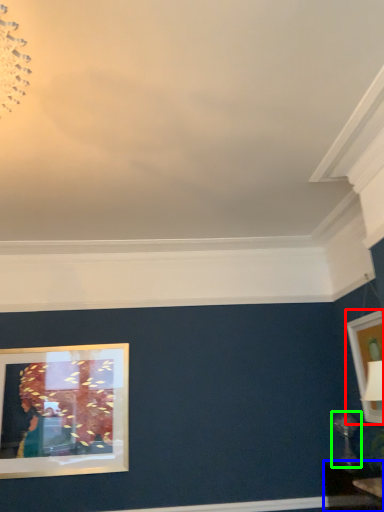
Question: Which is farther away from picture frame (highlighted by a red box)? table (highlighted by a blue box) or table lamp (highlighted by a green box)?

Choices:
 (A) table
 (B) table lamp

Answer: (A)